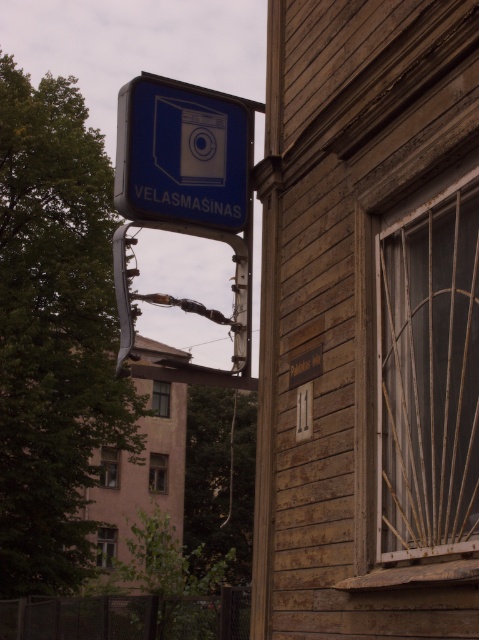
Question: Based on their relative distances, which object is farther from the transparent glass window at lower left?

Choices:
 (A) blue plastic sign at upper left
 (B) clear glass window at lower left
 (C) clear glass window at center

Answer: (A)

Question: Is wooden lattice window at right above clear glass window at center?

Choices:
 (A) yes
 (B) no

Answer: (A)

Question: Which of these objects is positioned closest to the clear glass window at center?

Choices:
 (A) blue plastic sign at upper left
 (B) transparent glass window at lower left
 (C) transparent glass window at center

Answer: (C)

Question: Among these objects, which one is farthest from the camera?

Choices:
 (A) clear glass window at lower left
 (B) transparent glass window at center
 (C) wooden lattice window at right
 (D) blue plastic sign at upper left

Answer: (B)

Question: Is wooden lattice window at right above transparent glass window at lower left?

Choices:
 (A) yes
 (B) no

Answer: (A)

Question: Can you confirm if wooden lattice window at right is positioned below clear glass window at center?

Choices:
 (A) yes
 (B) no

Answer: (B)